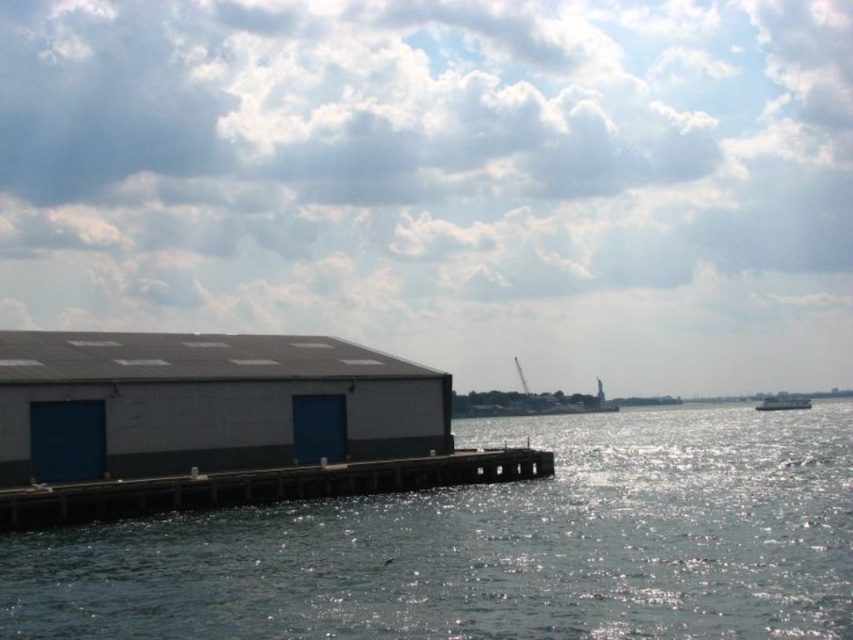
Question: Which point is closer to the camera?

Choices:
 (A) (164, 400)
 (B) (639, 458)
 (C) (502, 481)

Answer: (A)

Question: Can you confirm if glistening water at dock center is positioned to the right of gray metallic building at left?

Choices:
 (A) no
 (B) yes

Answer: (B)

Question: Considering the relative positions of glistening water at dock center and gray metallic building at left in the image provided, where is glistening water at dock center located with respect to gray metallic building at left?

Choices:
 (A) left
 (B) right

Answer: (B)

Question: Which of the following is the closest to the observer?

Choices:
 (A) (55, 556)
 (B) (775, 403)
 (C) (369, 486)
 (D) (164, 374)

Answer: (A)

Question: From the image, what is the correct spatial relationship of gray metallic building at left in relation to smooth wooden dock at center?

Choices:
 (A) right
 (B) left

Answer: (B)

Question: Estimate the real-world distances between objects in this image. Which object is closer to the gray metallic building at left?

Choices:
 (A) smooth wooden dock at center
 (B) white glossy boat at right
 (C) glistening water at dock center

Answer: (A)